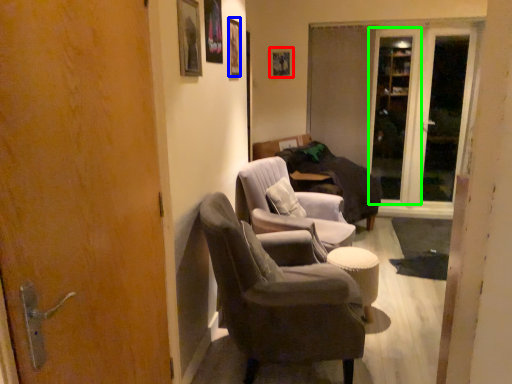
Question: Based on their relative distances, which object is farther from picture frame (highlighted by a red box)? Choose from picture frame (highlighted by a blue box) and screen door (highlighted by a green box).

Choices:
 (A) picture frame
 (B) screen door

Answer: (A)